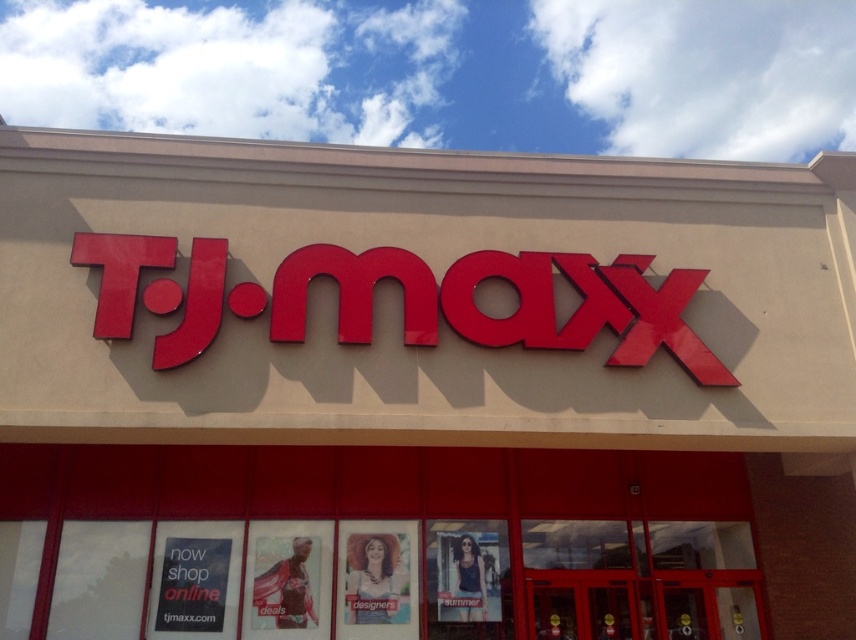
You are standing in front of the T.J.Maxx store and want to locate the glossy red sign at center. According to the coordinates provided, where exactly should you look?

You should look at point 0.492 on the x axis and 0.596 on the y axis to find the glossy red sign at center.

You are standing in front of the T.J.Maxx store and want to read both the glossy red sign at center and the black paper sign at lower left. Which sign do you need to look up at first?

The glossy red sign at center is above the black paper sign at lower left, so you need to look up at the glossy red sign at center first before looking down to the black paper sign at lower left.